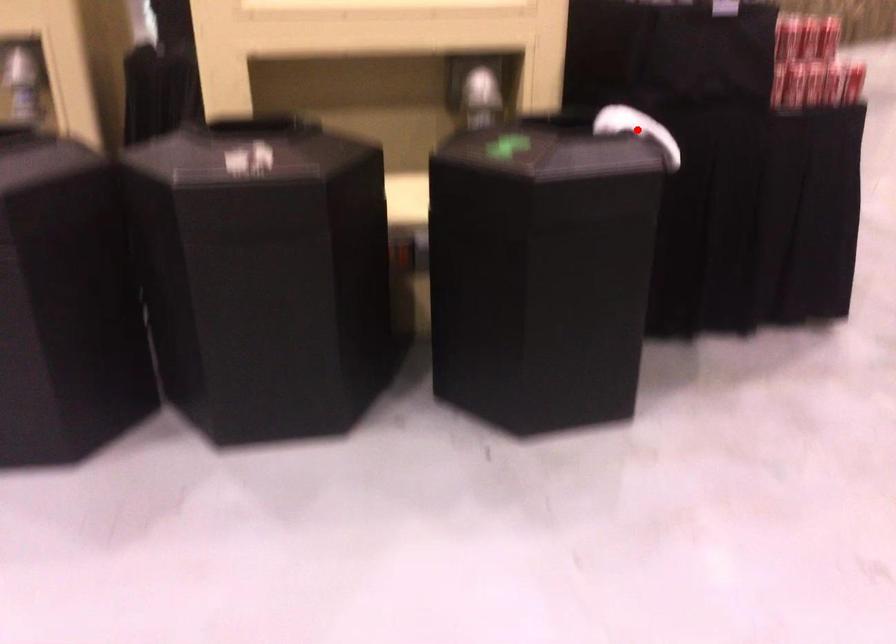
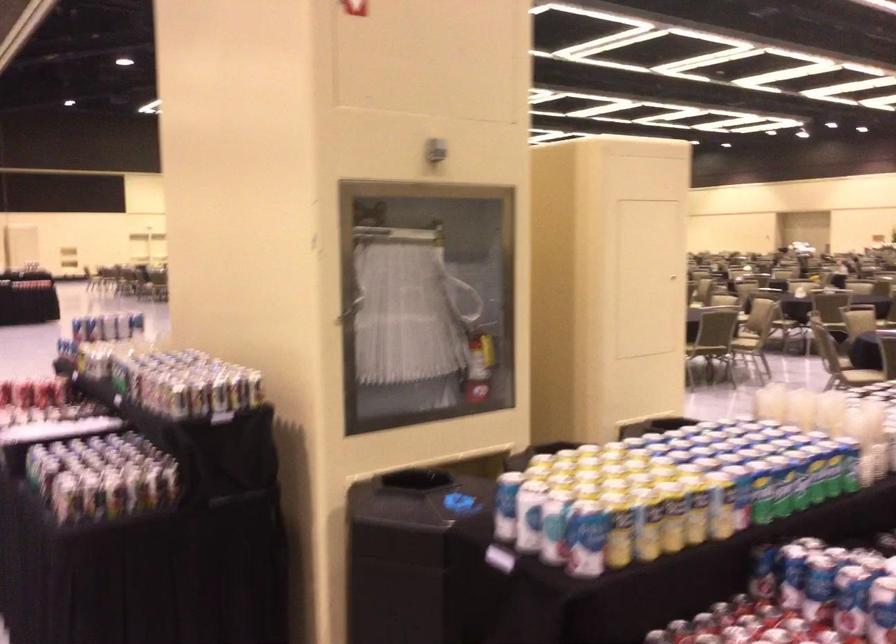
Question: I am providing you with two images of the same scene from different viewpoints. A red point is marked on the first image. At the location where the point appears in image 1, is it still visible in image 2?

Choices:
 (A) Yes
 (B) No

Answer: (B)